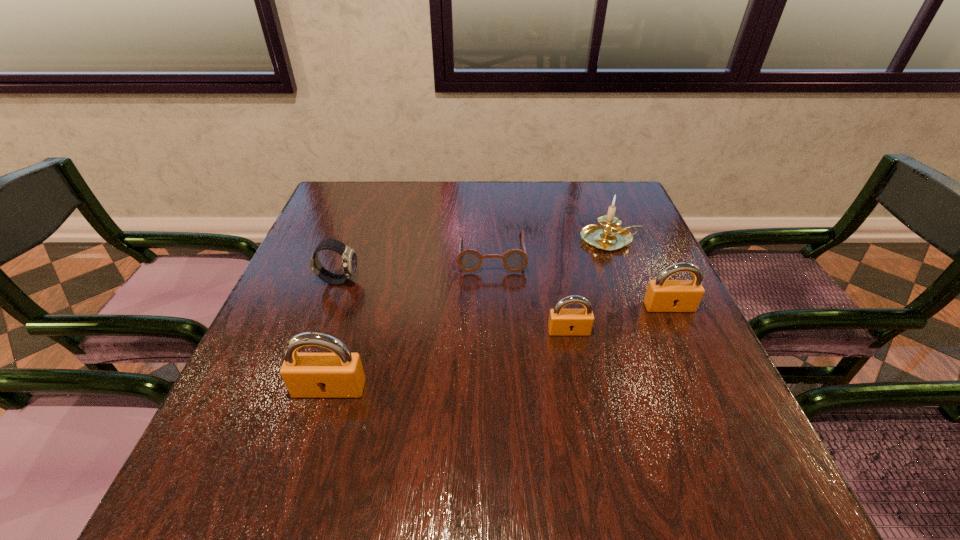
If equal spacing is the goal by inserting an additional padlock among them, please point out a vacant space for this new padlock. Please provide its 2D coordinates. Your answer should be formatted as a tuple, i.e. [(x, y)], where the tuple contains the x and y coordinates of a point satisfying the conditions above.

[(457, 358)]